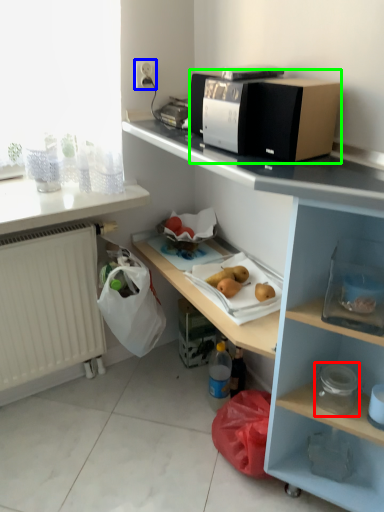
Question: Considering the real-world distances, which object is farthest from appliance (highlighted by a red box)? electric outlet (highlighted by a blue box) or home appliance (highlighted by a green box)?

Choices:
 (A) electric outlet
 (B) home appliance

Answer: (A)